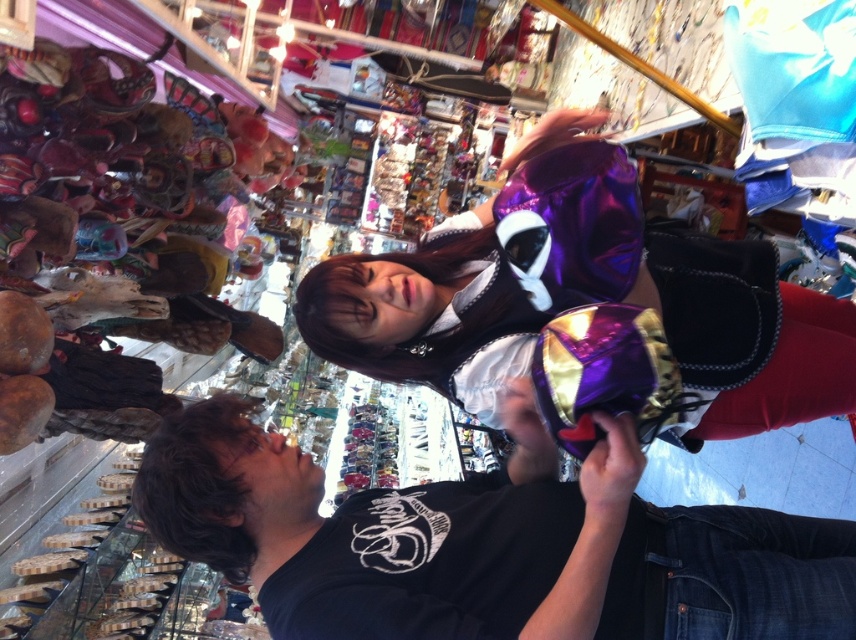
Question: Where is black matte shirt at lower center located in relation to shiny purple dress at center in the image?

Choices:
 (A) below
 (B) above

Answer: (A)

Question: Which point appears farthest from the camera in this image?

Choices:
 (A) (536, 202)
 (B) (308, 509)

Answer: (B)

Question: Is black matte shirt at lower center below shiny purple dress at center?

Choices:
 (A) yes
 (B) no

Answer: (A)

Question: Can you confirm if black matte shirt at lower center is wider than shiny purple dress at center?

Choices:
 (A) no
 (B) yes

Answer: (B)

Question: Which point is closer to the camera taking this photo?

Choices:
 (A) (771, 332)
 (B) (525, 560)

Answer: (B)